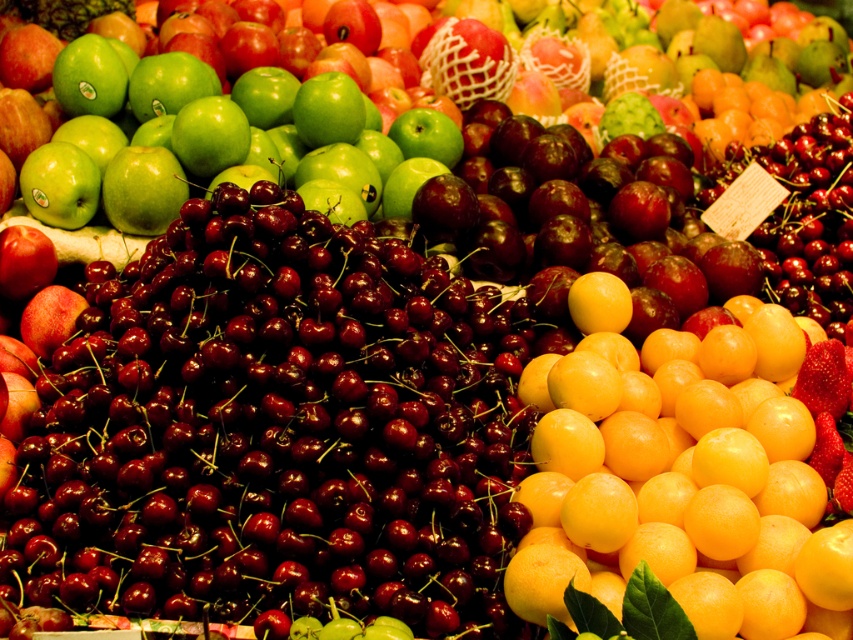
Who is taller, yellow matte/orange matte/orange smooth grapefruit at center or green matte apple at upper center?

yellow matte/orange matte/orange smooth grapefruit at center is taller.

Does yellow matte/orange matte/orange smooth grapefruit at center have a greater height compared to green matte apple at upper center?

Yes, yellow matte/orange matte/orange smooth grapefruit at center is taller than green matte apple at upper center.

Image resolution: width=853 pixels, height=640 pixels. Describe the element at coordinates (683, 470) in the screenshot. I see `yellow matte/orange matte/orange smooth grapefruit at center` at that location.

Find the location of a particular element. Image resolution: width=853 pixels, height=640 pixels. yellow matte/orange matte/orange smooth grapefruit at center is located at coordinates (683, 470).